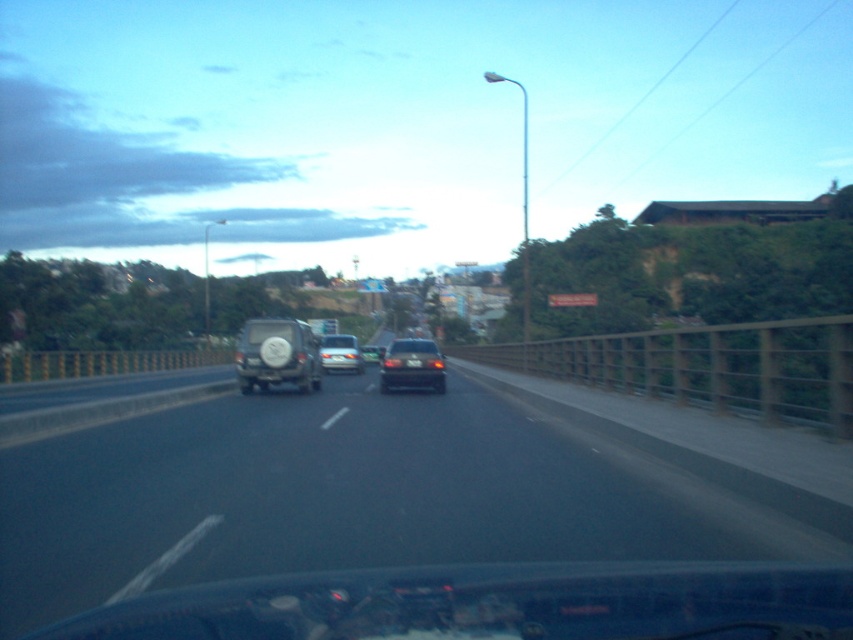
Does black asphalt highway at center have a lesser width compared to black plastic license plate at center?

No.

Does black asphalt highway at center lie in front of black plastic license plate at center?

That is True.

Where is `black asphalt highway at center`? The height and width of the screenshot is (640, 853). black asphalt highway at center is located at coordinates point(403,488).

Can you confirm if matte black suv at center is positioned below satin black sedan at center?

Incorrect, matte black suv at center is not positioned below satin black sedan at center.

Between point (276, 349) and point (402, 340), which one is positioned behind?

The point (402, 340) is behind.

The height and width of the screenshot is (640, 853). In order to click on matte black suv at center in this screenshot , I will do `click(276, 355)`.

Describe the element at coordinates (410, 368) in the screenshot. I see `satin black sedan at center` at that location.

Between point (433, 364) and point (416, 358), which one is positioned behind?

Point (433, 364)

Find the location of a particular element. satin black sedan at center is located at coordinates (410, 368).